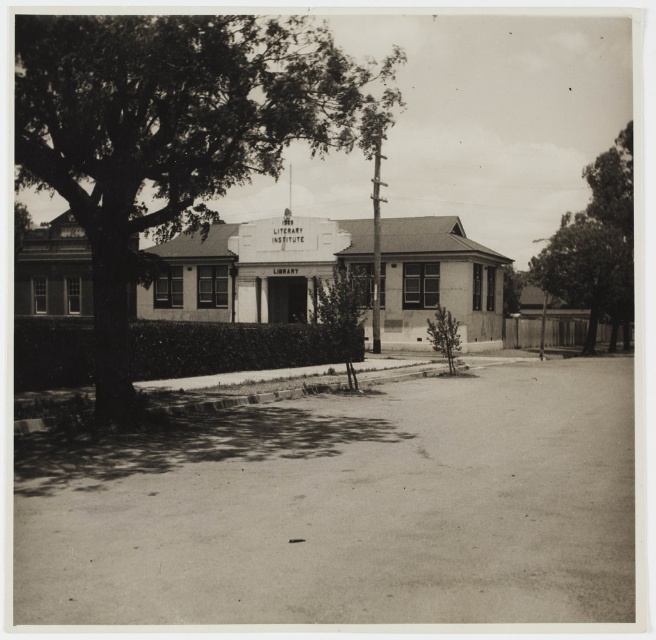
Is green leafy tree at upper left positioned in front of dark green leafy tree at right?

Yes, green leafy tree at upper left is in front of dark green leafy tree at right.

Does green leafy tree at upper left have a greater width compared to dark green leafy tree at right?

In fact, green leafy tree at upper left might be narrower than dark green leafy tree at right.

Is point (20, 148) in front of point (623, 131)?

Yes, point (20, 148) is in front of point (623, 131).

At what (x,y) coordinates should I click in order to perform the action: click on green leafy tree at upper left. Please return your answer as a coordinate pair (x, y). Looking at the image, I should click on (173, 132).